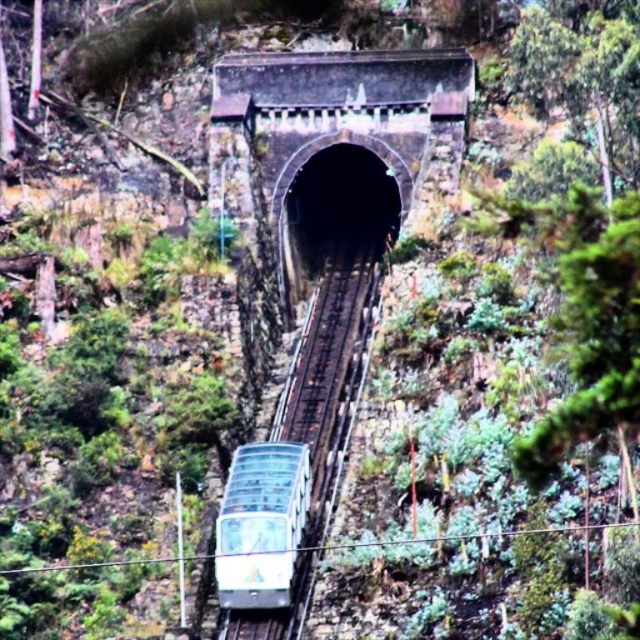
You are a maintenance worker checking the railway. You notice the metallic track at center and the clear glass train at center. Which object is taller?

The metallic track at center is taller than the clear glass train at center.

You are a railway inspector checking the track width compatibility. The clear glass train at center requires a track width of 1.5 meters. Can the metallic track at center accommodate the train?

The metallic track at center might be wider than clear glass train at center, so it can accommodate the train as long as the track width meets or exceeds 1.5 meters.